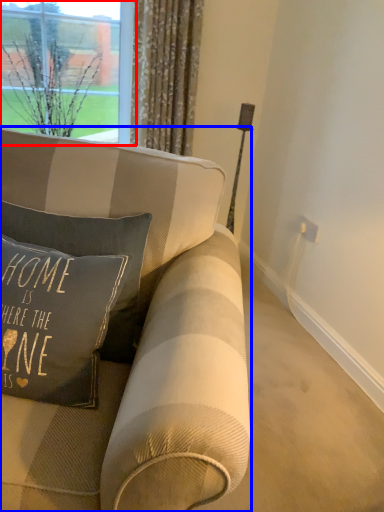
Question: Among these objects, which one is nearest to the camera, window (highlighted by a red box) or studio couch (highlighted by a blue box)?

Choices:
 (A) window
 (B) studio couch

Answer: (B)